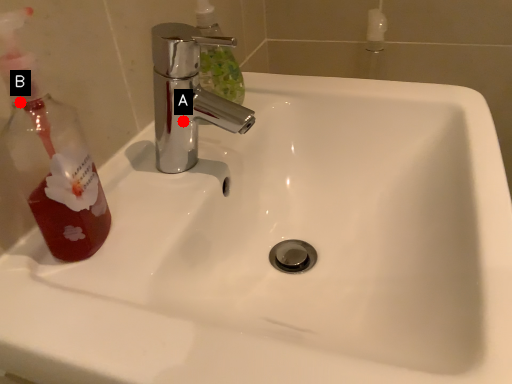
Question: Two points are circled on the image, labeled by A and B beside each circle. Which point appears closest to the camera in this image?

Choices:
 (A) A is closer
 (B) B is closer

Answer: (B)